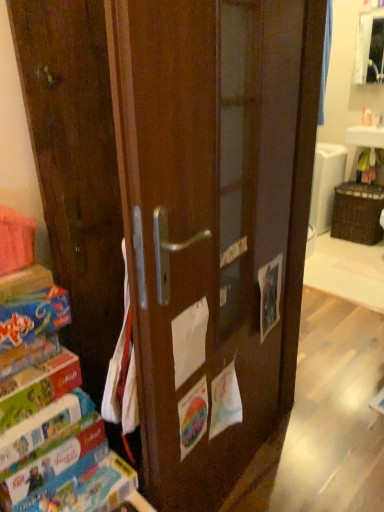
Locate an element on the screen. matte cardboard book at lower left, positioned as the 2th paperback book in top-to-bottom order is located at coordinates (38, 388).

In order to face matte brown cabinet at upper right, should I rotate leftwards or rightwards?

It's best to rotate right around 23.115 degrees.

What do you see at coordinates (369, 48) in the screenshot? This screenshot has height=512, width=384. I see `matte brown cabinet at upper right` at bounding box center [369, 48].

What do you see at coordinates (45, 430) in the screenshot?
I see `matte cardboard book at lower left, acting as the 2th paperback book starting from the bottom` at bounding box center [45, 430].

What do you see at coordinates (33, 316) in the screenshot? This screenshot has height=512, width=384. I see `matte cardboard book at left, the fourth paperback book in the bottom-to-top sequence` at bounding box center [33, 316].

This screenshot has width=384, height=512. Find the location of `matte cardboard book at lower left, arranged as the third paperback book when ordered from the bottom`. matte cardboard book at lower left, arranged as the third paperback book when ordered from the bottom is located at coordinates (38, 388).

Which is more to the right, matte cardboard book at left, the fourth paperback book in the bottom-to-top sequence, or matte brown cabinet at upper right?

Positioned to the right is matte brown cabinet at upper right.

Considering the relative sizes of matte cardboard book at left, the fourth paperback book in the bottom-to-top sequence, and matte brown cabinet at upper right in the image provided, is matte cardboard book at left, the fourth paperback book in the bottom-to-top sequence, wider than matte brown cabinet at upper right?

Yes.

From their relative heights in the image, would you say matte cardboard book at left, the fourth paperback book in the bottom-to-top sequence, is taller or shorter than matte brown cabinet at upper right?

matte cardboard book at left, the fourth paperback book in the bottom-to-top sequence, is shorter than matte brown cabinet at upper right.

Is matte cardboard book at left, which is counted as the 1th paperback book, starting from the top, turned away from matte brown cabinet at upper right?

No.

Is matte cardboard book at lower left, positioned as the 2th paperback book in top-to-bottom order, at the back of matte cardboard book at lower left, arranged as the third paperback book when viewed from the top?

No, matte cardboard book at lower left, arranged as the third paperback book when viewed from the top, is not facing away from matte cardboard book at lower left, positioned as the 2th paperback book in top-to-bottom order.

Between matte cardboard book at lower left, acting as the 2th paperback book starting from the bottom, and matte cardboard book at lower left, positioned as the 2th paperback book in top-to-bottom order, which one has smaller size?

With smaller size is matte cardboard book at lower left, positioned as the 2th paperback book in top-to-bottom order.

From a real-world perspective, is matte cardboard book at lower left, arranged as the third paperback book when viewed from the top, below matte cardboard book at lower left, positioned as the 2th paperback book in top-to-bottom order?

Yes, from a real-world perspective, matte cardboard book at lower left, arranged as the third paperback book when viewed from the top, is below matte cardboard book at lower left, positioned as the 2th paperback book in top-to-bottom order.

Consider the image. Is matte cardboard book at lower left, acting as the 2th paperback book starting from the bottom, not inside matte brown cabinet at upper right?

Yes, matte cardboard book at lower left, acting as the 2th paperback book starting from the bottom, is located beyond the bounds of matte brown cabinet at upper right.

Which is in front, point (52, 421) or point (377, 33)?

The point (52, 421) is more forward.

Considering the positions of objects hardcover book at left, which ranks as the fourth paperback book in top-to-bottom order, and matte cardboard book at lower left, arranged as the third paperback book when ordered from the bottom, in the image provided, who is more to the right, hardcover book at left, which ranks as the fourth paperback book in top-to-bottom order, or matte cardboard book at lower left, arranged as the third paperback book when ordered from the bottom,?

hardcover book at left, which ranks as the fourth paperback book in top-to-bottom order.

Does point (9, 482) appear closer or farther from the camera than point (73, 378)?

Point (9, 482) is closer to the camera than point (73, 378).

Who is smaller, hardcover book at left, which is the 1th paperback book in bottom-to-top order, or matte cardboard book at lower left, arranged as the third paperback book when ordered from the bottom?

hardcover book at left, which is the 1th paperback book in bottom-to-top order, is smaller.

Consider the image. Is matte brown cabinet at upper right facing away from matte cardboard book at lower left, arranged as the third paperback book when ordered from the bottom?

That's not correct — matte brown cabinet at upper right is not looking away from matte cardboard book at lower left, arranged as the third paperback book when ordered from the bottom.

Does matte brown cabinet at upper right have a greater width compared to matte cardboard book at lower left, arranged as the third paperback book when ordered from the bottom?

Incorrect, the width of matte brown cabinet at upper right does not surpass that of matte cardboard book at lower left, arranged as the third paperback book when ordered from the bottom.

The image size is (384, 512). Identify the location of the 3rd paperback book in front of the matte brown cabinet at upper right, starting your count from the anchor. (38, 388).

Considering the positions of point (370, 51) and point (53, 364), is point (370, 51) closer or farther from the camera than point (53, 364)?

Point (370, 51) is positioned farther from the camera compared to point (53, 364).

Is hardcover book at left, which is the 1th paperback book in bottom-to-top order, oriented towards matte brown cabinet at upper right?

No, hardcover book at left, which is the 1th paperback book in bottom-to-top order, is not aimed at matte brown cabinet at upper right.

From a real-world perspective, is hardcover book at left, which ranks as the fourth paperback book in top-to-bottom order, over matte brown cabinet at upper right?

Incorrect, from a real-world perspective, hardcover book at left, which ranks as the fourth paperback book in top-to-bottom order, is lower than matte brown cabinet at upper right.

Are hardcover book at left, which ranks as the fourth paperback book in top-to-bottom order, and matte brown cabinet at upper right far apart?

That's right, there is a large distance between hardcover book at left, which ranks as the fourth paperback book in top-to-bottom order, and matte brown cabinet at upper right.

Considering the positions of point (26, 495) and point (356, 55), is point (26, 495) closer or farther from the camera than point (356, 55)?

Point (26, 495).

Considering the points (39, 486) and (37, 451), which point is behind, point (39, 486) or point (37, 451)?

The point (39, 486) is behind.

Considering the positions of objects hardcover book at left, which ranks as the fourth paperback book in top-to-bottom order, and matte cardboard book at lower left, arranged as the third paperback book when viewed from the top, in the image provided, who is more to the right, hardcover book at left, which ranks as the fourth paperback book in top-to-bottom order, or matte cardboard book at lower left, arranged as the third paperback book when viewed from the top,?

hardcover book at left, which ranks as the fourth paperback book in top-to-bottom order.

How different are the orientations of hardcover book at left, which ranks as the fourth paperback book in top-to-bottom order, and matte cardboard book at lower left, acting as the 2th paperback book starting from the bottom, in degrees?

The angular difference between hardcover book at left, which ranks as the fourth paperback book in top-to-bottom order, and matte cardboard book at lower left, acting as the 2th paperback book starting from the bottom, is 4.44 degrees.

Considering the sizes of objects hardcover book at left, which ranks as the fourth paperback book in top-to-bottom order, and matte cardboard book at lower left, arranged as the third paperback book when viewed from the top, in the image provided, who is bigger, hardcover book at left, which ranks as the fourth paperback book in top-to-bottom order, or matte cardboard book at lower left, arranged as the third paperback book when viewed from the top,?

matte cardboard book at lower left, arranged as the third paperback book when viewed from the top.

At what (x,y) coordinates should I click in order to perform the action: click on paperback book that is the 4th one when counting forward from the matte brown cabinet at upper right. Please return your answer as a coordinate pair (x, y). The width and height of the screenshot is (384, 512). Looking at the image, I should click on (33, 316).

Find the location of a particular element. the 1st paperback book behind the matte cardboard book at lower left, positioned as the 2th paperback book in top-to-bottom order is located at coordinates (45, 430).

Looking at the image, which one is located closer to matte cardboard book at lower left, arranged as the third paperback book when ordered from the bottom, matte cardboard book at lower left, arranged as the third paperback book when viewed from the top, or matte brown cabinet at upper right?

Among the two, matte cardboard book at lower left, arranged as the third paperback book when viewed from the top, is located nearer to matte cardboard book at lower left, arranged as the third paperback book when ordered from the bottom.

Based on the photo, considering their positions, is matte cardboard book at lower left, arranged as the third paperback book when viewed from the top, positioned further to matte brown cabinet at upper right than hardcover book at left, which ranks as the fourth paperback book in top-to-bottom order?

Based on the image, hardcover book at left, which ranks as the fourth paperback book in top-to-bottom order, appears to be further to matte brown cabinet at upper right.

Estimate the real-world distances between objects in this image. Which object is further from matte brown cabinet at upper right, matte cardboard book at lower left, arranged as the third paperback book when viewed from the top, or matte cardboard book at lower left, positioned as the 2th paperback book in top-to-bottom order?

matte cardboard book at lower left, arranged as the third paperback book when viewed from the top, is positioned further to the anchor matte brown cabinet at upper right.

From the image, which object appears to be farther from matte cardboard book at left, which is counted as the 1th paperback book, starting from the top, matte cardboard book at lower left, acting as the 2th paperback book starting from the bottom, or matte brown cabinet at upper right?

Based on the image, matte brown cabinet at upper right appears to be further to matte cardboard book at left, which is counted as the 1th paperback book, starting from the top.

Based on their spatial positions, is matte cardboard book at lower left, arranged as the third paperback book when viewed from the top, or matte cardboard book at lower left, arranged as the third paperback book when ordered from the bottom, closer to hardcover book at left, which ranks as the fourth paperback book in top-to-bottom order?

Among the two, matte cardboard book at lower left, arranged as the third paperback book when viewed from the top, is located nearer to hardcover book at left, which ranks as the fourth paperback book in top-to-bottom order.

Looking at the image, which one is located further to hardcover book at left, which is the 1th paperback book in bottom-to-top order, matte cardboard book at lower left, acting as the 2th paperback book starting from the bottom, or matte cardboard book at left, which is counted as the 1th paperback book, starting from the top?

matte cardboard book at left, which is counted as the 1th paperback book, starting from the top.

Estimate the real-world distances between objects in this image. Which object is further from matte cardboard book at lower left, acting as the 2th paperback book starting from the bottom, matte cardboard book at lower left, positioned as the 2th paperback book in top-to-bottom order, or matte brown cabinet at upper right?

matte brown cabinet at upper right is further to matte cardboard book at lower left, acting as the 2th paperback book starting from the bottom.

Looking at the image, which one is located further to hardcover book at left, which ranks as the fourth paperback book in top-to-bottom order, matte cardboard book at left, which is counted as the 1th paperback book, starting from the top, or matte cardboard book at lower left, arranged as the third paperback book when ordered from the bottom?

Based on the image, matte cardboard book at left, which is counted as the 1th paperback book, starting from the top, appears to be further to hardcover book at left, which ranks as the fourth paperback book in top-to-bottom order.

The height and width of the screenshot is (512, 384). I want to click on paperback book between matte cardboard book at lower left, arranged as the third paperback book when ordered from the bottom, and hardcover book at left, which is the 1th paperback book in bottom-to-top order, in the vertical direction, so click(x=45, y=430).

I want to click on paperback book positioned between matte cardboard book at lower left, acting as the 2th paperback book starting from the bottom, and matte brown cabinet at upper right from near to far, so pos(52,468).

Locate an element on the screen. paperback book between matte cardboard book at left, the fourth paperback book in the bottom-to-top sequence, and matte cardboard book at lower left, arranged as the third paperback book when viewed from the top, vertically is located at coordinates (38, 388).